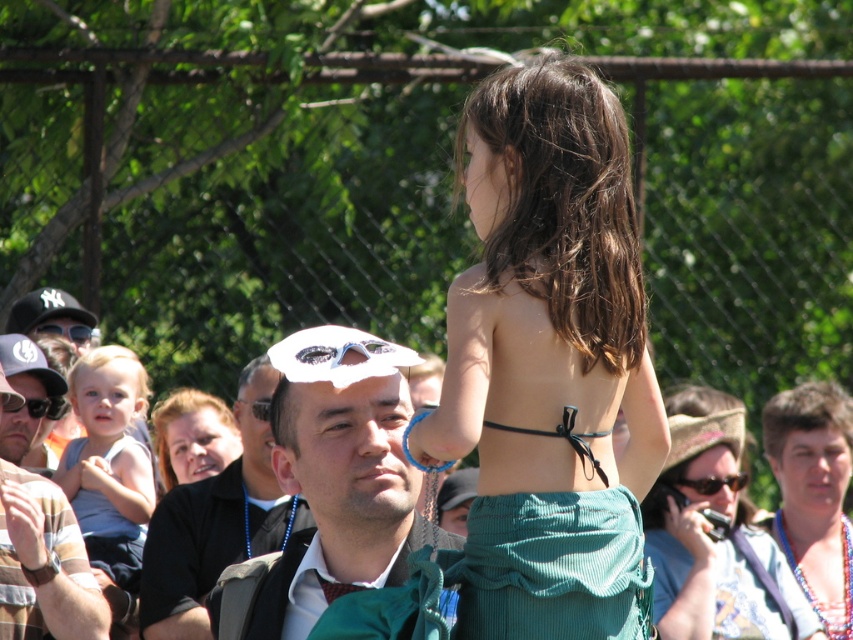
Question: Which point is closer to the camera taking this photo?

Choices:
 (A) (184, 545)
 (B) (97, 424)
 (C) (152, 419)
 (D) (357, 467)

Answer: (D)

Question: From the image, what is the correct spatial relationship of black satin bikini top at upper center in relation to light blue sleeveless shirt at left?

Choices:
 (A) right
 (B) left

Answer: (A)

Question: Which object appears closest to the camera in this image?

Choices:
 (A) black fabric shirt at center
 (B) matte white hat at center
 (C) teal corduroy skirt at center

Answer: (C)

Question: Is matte green skirt at center above black fabric shirt at center?

Choices:
 (A) yes
 (B) no

Answer: (B)

Question: Which is nearer to the white matte goggles at center?

Choices:
 (A) striped cotton shirt at left
 (B) black fabric shirt at center

Answer: (B)

Question: Does teal corduroy skirt at center appear under matte green skirt at center?

Choices:
 (A) yes
 (B) no

Answer: (B)